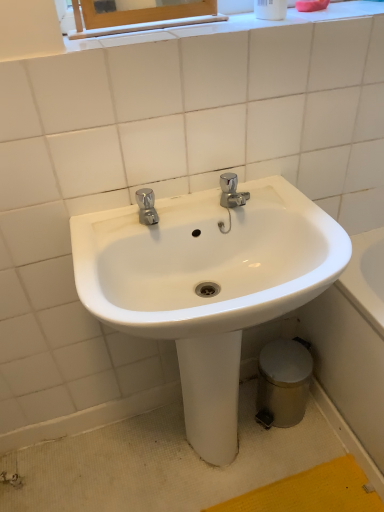
Question: Is point (297, 353) positioned closer to the camera than point (225, 244)?

Choices:
 (A) closer
 (B) farther

Answer: (B)

Question: From the image's perspective, is silver metallic trash can at lower right above or below white glossy sink at center?

Choices:
 (A) below
 (B) above

Answer: (A)

Question: In terms of height, does silver metallic trash can at lower right look taller or shorter compared to white glossy sink at center?

Choices:
 (A) short
 (B) tall

Answer: (A)

Question: Is white glossy sink at center in front of or behind silver metallic trash can at lower right in the image?

Choices:
 (A) front
 (B) behind

Answer: (A)

Question: Would you say white glossy sink at center is inside or outside silver metallic trash can at lower right?

Choices:
 (A) outside
 (B) inside

Answer: (A)

Question: Is white glossy sink at center bigger or smaller than silver metallic trash can at lower right?

Choices:
 (A) big
 (B) small

Answer: (A)

Question: From a real-world perspective, is white glossy sink at center positioned above or below silver metallic trash can at lower right?

Choices:
 (A) below
 (B) above

Answer: (B)